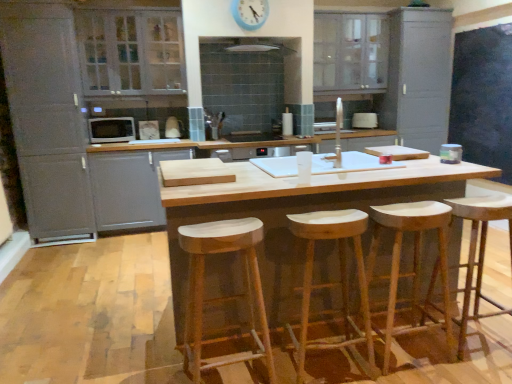
Question: Considering the relative sizes of natural wood stool at center, the 2th stool from the right, and white glossy microwave at left, which is the 2th appliance from back to front, in the image provided, is natural wood stool at center, the 2th stool from the right, shorter than white glossy microwave at left, which is the 2th appliance from back to front,?

Choices:
 (A) yes
 (B) no

Answer: (B)

Question: Is natural wood stool at center, the 2th stool from the right, oriented towards white glossy microwave at left, which is the 2th appliance from back to front?

Choices:
 (A) yes
 (B) no

Answer: (B)

Question: Does natural wood stool at center, the 2th stool from the right, appear on the left side of white glossy microwave at left, which is the second appliance from right to left?

Choices:
 (A) yes
 (B) no

Answer: (B)

Question: Is natural wood stool at center, the 2th stool from the right, smaller than white glossy microwave at left, which is the second appliance from right to left?

Choices:
 (A) yes
 (B) no

Answer: (B)

Question: Is natural wood stool at center, the second stool viewed from the left, oriented away from white glossy microwave at left, arranged as the first appliance when viewed from the left?

Choices:
 (A) yes
 (B) no

Answer: (B)

Question: Is white glossy exhaust hood at upper center bigger or smaller than white glossy toaster at center, acting as the 2th appliance starting from the left?

Choices:
 (A) small
 (B) big

Answer: (B)

Question: From a real-world perspective, is white glossy exhaust hood at upper center above or below white glossy toaster at center, acting as the 2th appliance starting from the left?

Choices:
 (A) above
 (B) below

Answer: (A)

Question: Visually, is white glossy exhaust hood at upper center positioned to the left or to the right of white glossy toaster at center, marked as the 1th appliance in a back-to-front arrangement?

Choices:
 (A) right
 (B) left

Answer: (B)

Question: Considering the positions of white glossy exhaust hood at upper center and white glossy toaster at center, acting as the 2th appliance starting from the left, in the image, is white glossy exhaust hood at upper center wider or thinner than white glossy toaster at center, acting as the 2th appliance starting from the left,?

Choices:
 (A) thin
 (B) wide

Answer: (B)

Question: Considering the positions of white glass cabinet at upper left, which appears as the 4th cabinetry when viewed from the right, and matte gray cabinet at left, which is counted as the 1th cabinetry, starting from the left, in the image, is white glass cabinet at upper left, which appears as the 4th cabinetry when viewed from the right, bigger or smaller than matte gray cabinet at left, which is counted as the 1th cabinetry, starting from the left,?

Choices:
 (A) big
 (B) small

Answer: (B)

Question: From a real-world perspective, is white glass cabinet at upper left, which appears as the 4th cabinetry when viewed from the right, positioned above or below matte gray cabinet at left, which is counted as the 5th cabinetry, starting from the right?

Choices:
 (A) below
 (B) above

Answer: (B)

Question: From the image's perspective, is white glass cabinet at upper left, which is the second cabinetry from left to right, above or below matte gray cabinet at left, which is counted as the 1th cabinetry, starting from the left?

Choices:
 (A) above
 (B) below

Answer: (A)

Question: Does point (95, 26) appear closer or farther from the camera than point (174, 34)?

Choices:
 (A) closer
 (B) farther

Answer: (A)

Question: From a real-world perspective, is white glossy toaster at center, which is the first appliance in right-to-left order, above or below blue plastic clock at upper center?

Choices:
 (A) above
 (B) below

Answer: (B)

Question: Choose the correct answer: Is white glossy toaster at center, acting as the 2th appliance starting from the left, inside blue plastic clock at upper center or outside it?

Choices:
 (A) outside
 (B) inside

Answer: (A)